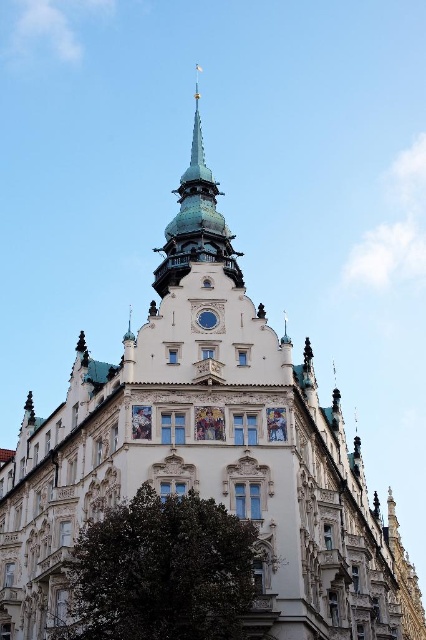
Which is in front, point (180, 280) or point (201, 316)?

Point (201, 316) is more forward.

Does green metallic spire at upper center have a lesser width compared to blue glass clock at center?

No, green metallic spire at upper center is not thinner than blue glass clock at center.

Which is behind, point (196, 97) or point (198, 323)?

The point (196, 97) is behind.

Locate an element on the screen. green metallic spire at upper center is located at coordinates (195, 221).